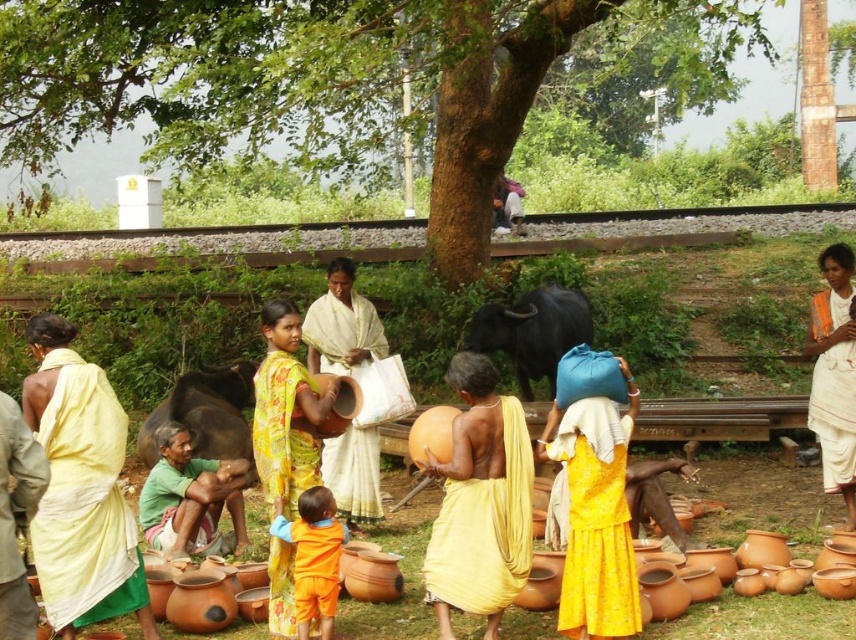
Can you confirm if green cotton shirt at lower left is smaller than orange cotton shirt at center?

No.

I want to click on green cotton shirt at lower left, so click(x=189, y=497).

Between point (490, 394) and point (296, 552), which one is positioned behind?

The point (296, 552) is more distant.

Does point (530, 561) lie in front of point (337, 566)?

Yes, point (530, 561) is closer to viewer.

Locate an element on the screen. Image resolution: width=856 pixels, height=640 pixels. matte yellow fabric at center is located at coordinates (480, 502).

Who is positioned more to the right, yellow fabric at left or orange cotton shirt at center?

Positioned to the right is orange cotton shirt at center.

Is yellow fabric at left in front of orange cotton shirt at center?

Yes, yellow fabric at left is closer to the viewer.

What do you see at coordinates (80, 488) in the screenshot? The image size is (856, 640). I see `yellow fabric at left` at bounding box center [80, 488].

Identify the location of yellow fabric at left. (80, 488).